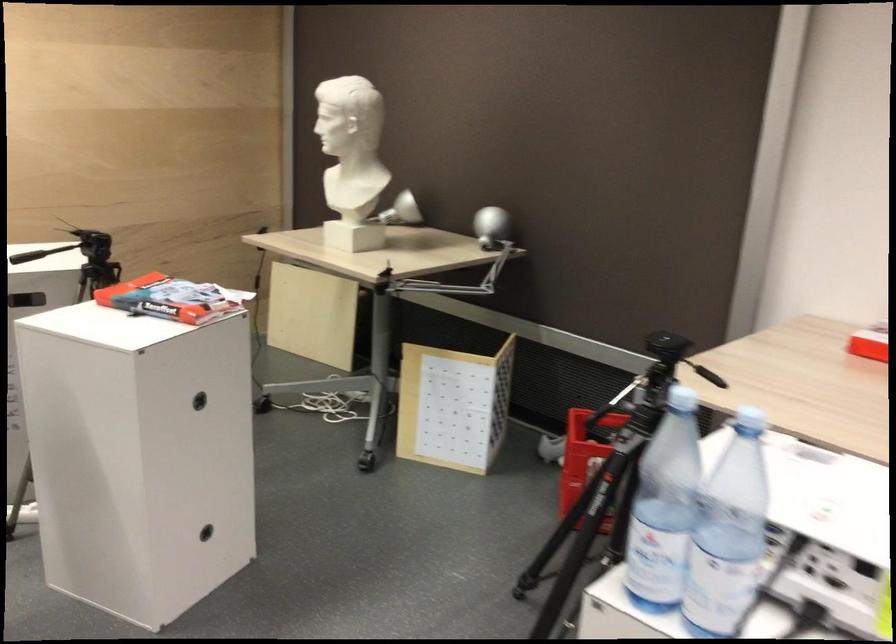
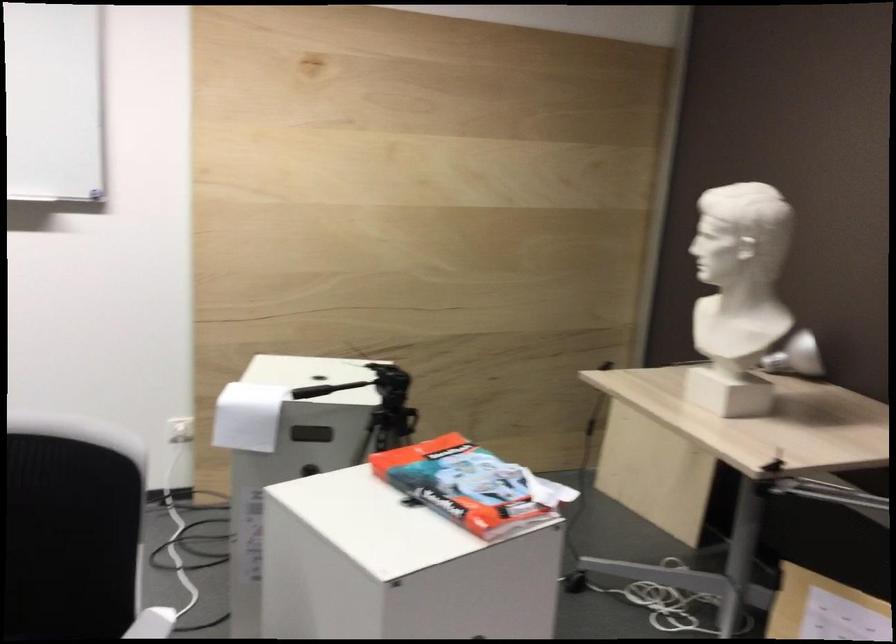
Where in the second image is the point corresponding to the point at 174,301 from the first image?

(462, 485)